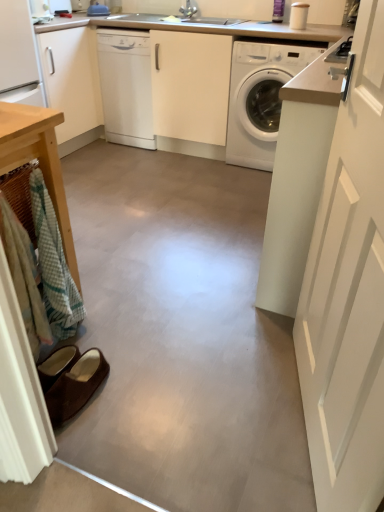
At what (x,y) coordinates should I click in order to perform the action: click on free space behind white matte door at right. Please return your answer as a coordinate pair (x, y). Image resolution: width=384 pixels, height=512 pixels. Looking at the image, I should click on (239, 325).